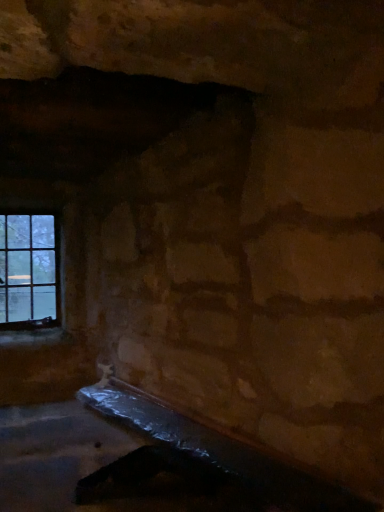
The width and height of the screenshot is (384, 512). I want to click on clear glass window at left, so click(27, 269).

What do you see at coordinates (27, 269) in the screenshot? I see `clear glass window at left` at bounding box center [27, 269].

The height and width of the screenshot is (512, 384). What are the coordinates of `clear glass window at left` in the screenshot? It's located at (27, 269).